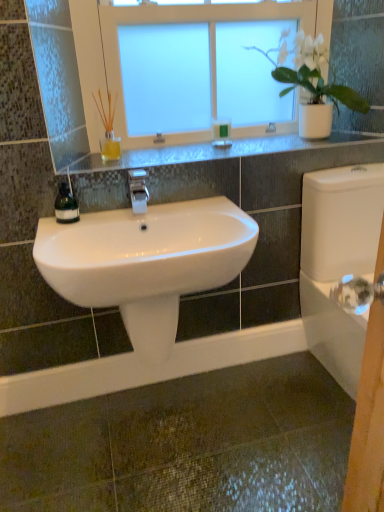
You are a GUI agent. You are given a task and a screenshot of the screen. Output one action in this format:
    pyautogui.click(x=<x>, y=<y>)
    Task: Click on the vacant space to the right of white glossy faucet at center
    
    Given the screenshot: What is the action you would take?
    pyautogui.click(x=194, y=210)